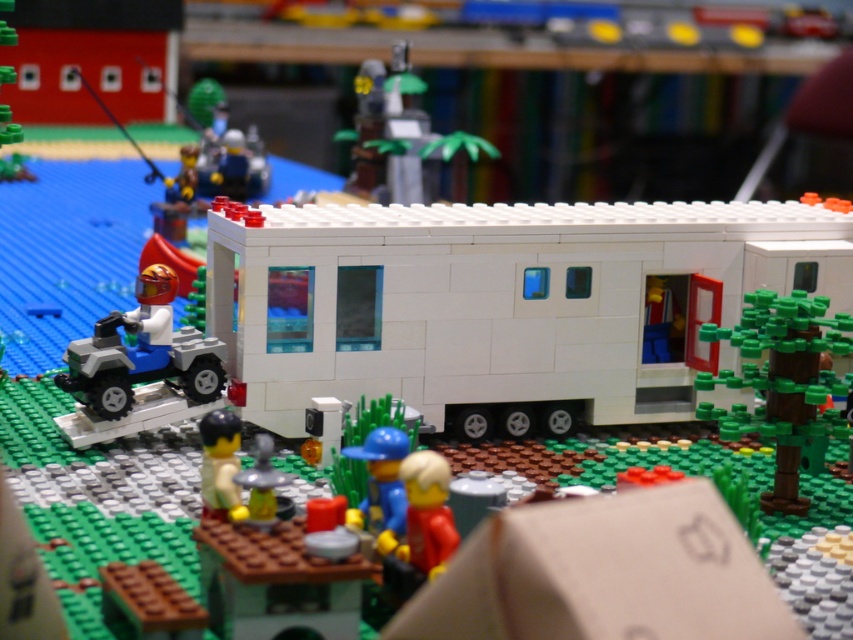
Question: Is white plastic trailer at center below translucent yellow figure at center?

Choices:
 (A) yes
 (B) no

Answer: (B)

Question: Which object appears farthest from the camera in this image?

Choices:
 (A) black plastic minifigure at lower center
 (B) smooth red figure at center
 (C) translucent yellow figure at center
 (D) white plastic trailer at center

Answer: (D)

Question: Is green plastic tree at center-right closer to the viewer compared to black plastic minifigure at lower center?

Choices:
 (A) yes
 (B) no

Answer: (B)

Question: Estimate the real-world distances between objects in this image. Which object is closer to the green plastic tree at center-right?

Choices:
 (A) black plastic minifigure at lower center
 (B) smooth red figure at center
 (C) translucent yellow figure at center

Answer: (B)

Question: Does white plastic trailer at center appear on the left side of green plastic tree at center-right?

Choices:
 (A) yes
 (B) no

Answer: (A)

Question: Which of the following is the closest to the observer?

Choices:
 (A) white plastic trailer at center
 (B) translucent yellow figure at center

Answer: (B)